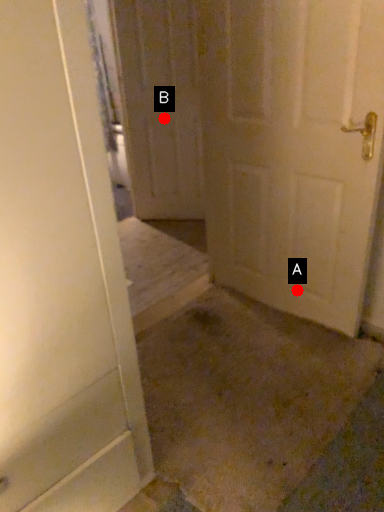
Question: Two points are circled on the image, labeled by A and B beside each circle. Which of the following is the closest to the observer?

Choices:
 (A) A is closer
 (B) B is closer

Answer: (A)